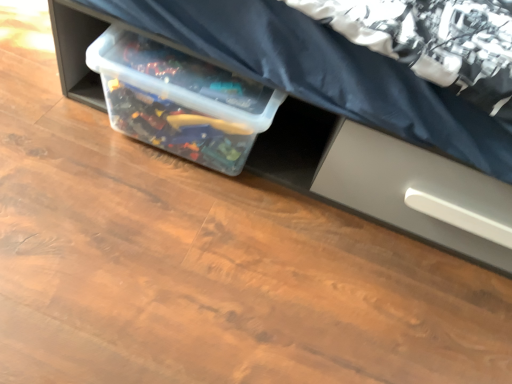
Locate an element on the screen. vacant area in front of transparent plastic container at center is located at coordinates click(x=162, y=235).